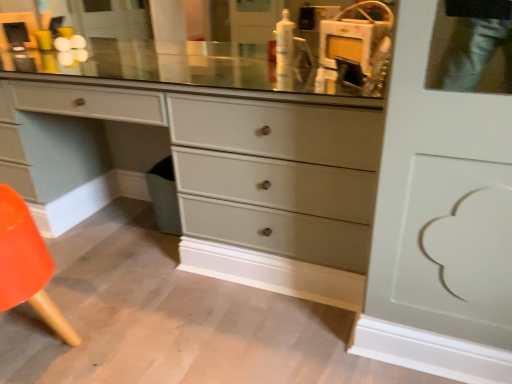
Question: Considering the positions of matte gray dresser at center and orange plastic chair at lower left in the image, is matte gray dresser at center bigger or smaller than orange plastic chair at lower left?

Choices:
 (A) small
 (B) big

Answer: (B)

Question: Would you say matte gray dresser at center is to the left or to the right of orange plastic chair at lower left in the picture?

Choices:
 (A) left
 (B) right

Answer: (B)

Question: Which object is the closest to the matte gray dresser at center?

Choices:
 (A) white glossy lotion at upper center
 (B) orange plastic chair at lower left

Answer: (A)

Question: Which is nearer to the white glossy lotion at upper center?

Choices:
 (A) orange plastic chair at lower left
 (B) matte gray dresser at center

Answer: (B)